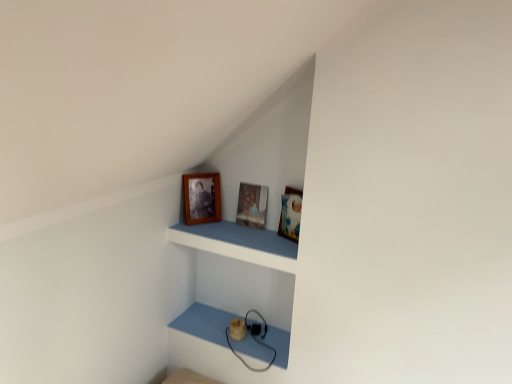
Identify the location of wooden photo frame at upper center, which is counted as the second picture frame, starting from the right. This screenshot has width=512, height=384. (201, 198).

What do you see at coordinates (201, 198) in the screenshot?
I see `wooden photo frame at upper center, which is counted as the second picture frame, starting from the right` at bounding box center [201, 198].

The height and width of the screenshot is (384, 512). Find the location of `wooden frame at upper center`. wooden frame at upper center is located at coordinates (239, 243).

From the image's perspective, is wooden photo frame at upper center, placed as the 1th picture frame when sorted from left to right, located beneath wooden picture frame at center, positioned as the 2th picture frame in left-to-right order?

Actually, wooden photo frame at upper center, placed as the 1th picture frame when sorted from left to right, appears above wooden picture frame at center, positioned as the 2th picture frame in left-to-right order, in the image.

Is wooden picture frame at center, which is the first picture frame in right-to-left order, at the back of wooden photo frame at upper center, which is counted as the second picture frame, starting from the right?

That's not correct — wooden photo frame at upper center, which is counted as the second picture frame, starting from the right, is not looking away from wooden picture frame at center, which is the first picture frame in right-to-left order.

Consider the image. Can you confirm if wooden photo frame at upper center, which is counted as the second picture frame, starting from the right, is taller than wooden picture frame at center, positioned as the 2th picture frame in left-to-right order?

Indeed, wooden photo frame at upper center, which is counted as the second picture frame, starting from the right, has a greater height compared to wooden picture frame at center, positioned as the 2th picture frame in left-to-right order.

Is wooden photo frame at upper center, which is counted as the second picture frame, starting from the right, far from wooden picture frame at center, which is the first picture frame in right-to-left order?

No, wooden photo frame at upper center, which is counted as the second picture frame, starting from the right, is not far away from wooden picture frame at center, which is the first picture frame in right-to-left order.

From a real-world perspective, between wooden frame at upper center and wooden picture frame at center, positioned as the 2th picture frame in left-to-right order, who is vertically lower?

From a 3D spatial view, wooden frame at upper center is below.

Who is taller, wooden frame at upper center or wooden picture frame at center, which is the first picture frame in right-to-left order?

With more height is wooden picture frame at center, which is the first picture frame in right-to-left order.

Considering the relative sizes of wooden frame at upper center and wooden picture frame at center, positioned as the 2th picture frame in left-to-right order, in the image provided, is wooden frame at upper center wider than wooden picture frame at center, positioned as the 2th picture frame in left-to-right order,?

Yes, wooden frame at upper center is wider than wooden picture frame at center, positioned as the 2th picture frame in left-to-right order.

Is wooden picture frame at center, which is the first picture frame in right-to-left order, at the back of wooden frame at upper center?

wooden frame at upper center is not turned away from wooden picture frame at center, which is the first picture frame in right-to-left order.

Considering the positions of objects wooden frame at upper center and wooden photo frame at upper center, which is counted as the second picture frame, starting from the right, in the image provided, who is in front, wooden frame at upper center or wooden photo frame at upper center, which is counted as the second picture frame, starting from the right,?

wooden frame at upper center.

Between wooden frame at upper center and wooden photo frame at upper center, which is counted as the second picture frame, starting from the right, which one has more height?

With more height is wooden photo frame at upper center, which is counted as the second picture frame, starting from the right.

How distant is wooden frame at upper center from wooden photo frame at upper center, placed as the 1th picture frame when sorted from left to right?

They are 7.58 inches apart.

Which object is positioned more to the right, wooden frame at upper center or wooden photo frame at upper center, placed as the 1th picture frame when sorted from left to right?

wooden frame at upper center is more to the right.

From a real-world perspective, which is physically below, wooden picture frame at center, positioned as the 2th picture frame in left-to-right order, or wooden photo frame at upper center, which is counted as the second picture frame, starting from the right?

wooden picture frame at center, positioned as the 2th picture frame in left-to-right order, is physically lower.

Could you measure the distance between wooden picture frame at center, which is the first picture frame in right-to-left order, and wooden photo frame at upper center, placed as the 1th picture frame when sorted from left to right?

The distance of wooden picture frame at center, which is the first picture frame in right-to-left order, from wooden photo frame at upper center, placed as the 1th picture frame when sorted from left to right, is 6.36 inches.

In the image, is wooden picture frame at center, positioned as the 2th picture frame in left-to-right order, positioned in front of or behind wooden photo frame at upper center, which is counted as the second picture frame, starting from the right?

wooden picture frame at center, positioned as the 2th picture frame in left-to-right order, is behind wooden photo frame at upper center, which is counted as the second picture frame, starting from the right.

Are wooden picture frame at center, which is the first picture frame in right-to-left order, and wooden photo frame at upper center, placed as the 1th picture frame when sorted from left to right, making contact?

wooden picture frame at center, which is the first picture frame in right-to-left order, and wooden photo frame at upper center, placed as the 1th picture frame when sorted from left to right, are clearly separated.

Would you consider wooden picture frame at center, which is the first picture frame in right-to-left order, to be distant from wooden frame at upper center?

No, wooden picture frame at center, which is the first picture frame in right-to-left order, is not far from wooden frame at upper center.

Is wooden picture frame at center, which is the first picture frame in right-to-left order, inside or outside of wooden frame at upper center?

The correct answer is: outside.

Is wooden picture frame at center, which is the first picture frame in right-to-left order, in front of or behind wooden frame at upper center in the image?

wooden picture frame at center, which is the first picture frame in right-to-left order, is behind wooden frame at upper center.

Does wooden picture frame at center, which is the first picture frame in right-to-left order, have a lesser height compared to wooden frame at upper center?

In fact, wooden picture frame at center, which is the first picture frame in right-to-left order, may be taller than wooden frame at upper center.

Is wooden frame at upper center located within wooden photo frame at upper center, placed as the 1th picture frame when sorted from left to right?

Actually, wooden frame at upper center is outside wooden photo frame at upper center, placed as the 1th picture frame when sorted from left to right.

From the image's perspective, is wooden photo frame at upper center, which is counted as the second picture frame, starting from the right, below wooden frame at upper center?

No.

In the image, is wooden photo frame at upper center, which is counted as the second picture frame, starting from the right, on the left side or the right side of wooden frame at upper center?

wooden photo frame at upper center, which is counted as the second picture frame, starting from the right, is to the left of wooden frame at upper center.

Is wooden photo frame at upper center, which is counted as the second picture frame, starting from the right, shorter than wooden frame at upper center?

Incorrect, the height of wooden photo frame at upper center, which is counted as the second picture frame, starting from the right, does not fall short of that of wooden frame at upper center.

Find the location of a particular element. This screenshot has height=384, width=512. picture frame that appears on the left of wooden picture frame at center, positioned as the 2th picture frame in left-to-right order is located at coordinates (201, 198).

Find the location of a particular element. This screenshot has width=512, height=384. the 1st picture frame directly above the wooden frame at upper center (from a real-world perspective) is located at coordinates (252, 205).

Estimate the real-world distances between objects in this image. Which object is further from wooden frame at upper center, wooden photo frame at upper center, which is counted as the second picture frame, starting from the right, or wooden picture frame at center, which is the first picture frame in right-to-left order?

The object further to wooden frame at upper center is wooden photo frame at upper center, which is counted as the second picture frame, starting from the right.

Based on their spatial positions, is wooden photo frame at upper center, placed as the 1th picture frame when sorted from left to right, or wooden frame at upper center further from wooden picture frame at center, which is the first picture frame in right-to-left order?

wooden photo frame at upper center, placed as the 1th picture frame when sorted from left to right, lies further to wooden picture frame at center, which is the first picture frame in right-to-left order, than the other object.

Consider the image. Looking at the image, which one is located closer to wooden picture frame at center, positioned as the 2th picture frame in left-to-right order, wooden frame at upper center or wooden photo frame at upper center, which is counted as the second picture frame, starting from the right?

The object closer to wooden picture frame at center, positioned as the 2th picture frame in left-to-right order, is wooden frame at upper center.

From the image, which object appears to be nearer to wooden photo frame at upper center, which is counted as the second picture frame, starting from the right, wooden picture frame at center, positioned as the 2th picture frame in left-to-right order, or wooden frame at upper center?

wooden picture frame at center, positioned as the 2th picture frame in left-to-right order, is closer to wooden photo frame at upper center, which is counted as the second picture frame, starting from the right.

When comparing their distances from wooden photo frame at upper center, placed as the 1th picture frame when sorted from left to right, does wooden frame at upper center or wooden picture frame at center, positioned as the 2th picture frame in left-to-right order, seem closer?

wooden picture frame at center, positioned as the 2th picture frame in left-to-right order, is closer to wooden photo frame at upper center, placed as the 1th picture frame when sorted from left to right.

When comparing their distances from wooden frame at upper center, does wooden picture frame at center, positioned as the 2th picture frame in left-to-right order, or wooden photo frame at upper center, placed as the 1th picture frame when sorted from left to right, seem further?

wooden photo frame at upper center, placed as the 1th picture frame when sorted from left to right, is positioned further to the anchor wooden frame at upper center.

I want to click on picture frame located between wooden frame at upper center and wooden picture frame at center, which is the first picture frame in right-to-left order, in the depth direction, so click(201, 198).